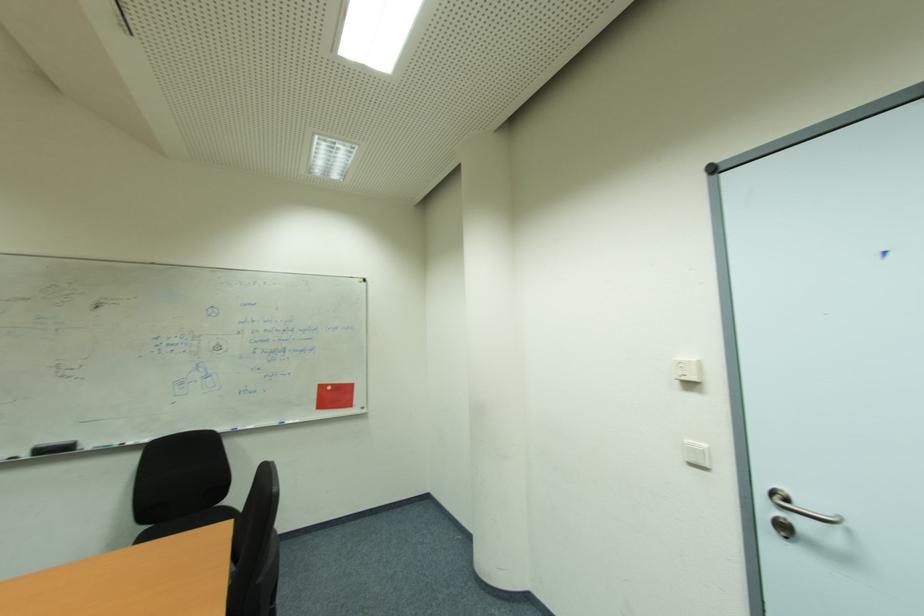
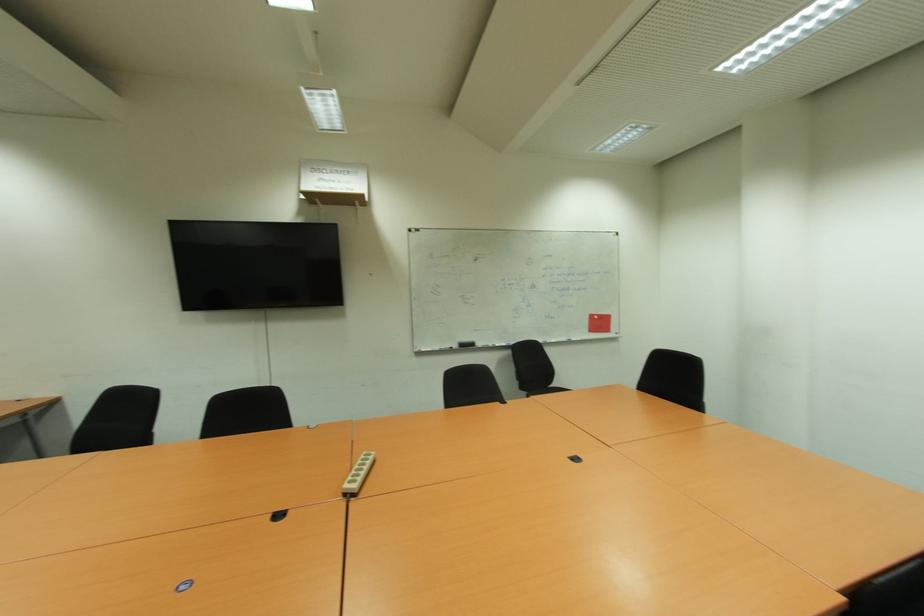
Where in the second image is the point corresponding to point 30,456 from the first image?

(457, 347)